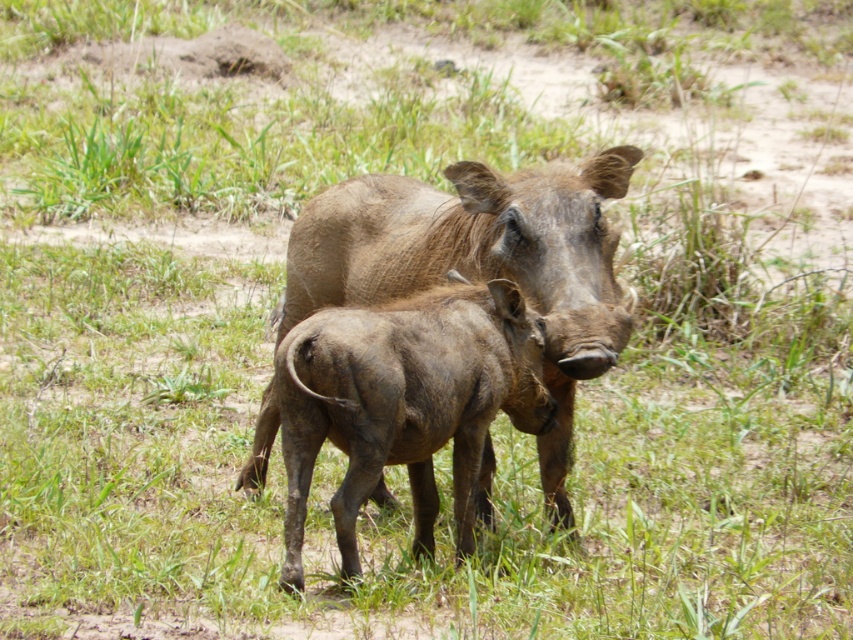
Between brown textured pig at center and brown textured warthog at center, which one is positioned lower?

brown textured warthog at center is below.

Does point (567, 440) come farther from viewer compared to point (456, 344)?

That is True.

Locate an element on the screen. The width and height of the screenshot is (853, 640). brown textured pig at center is located at coordinates (480, 262).